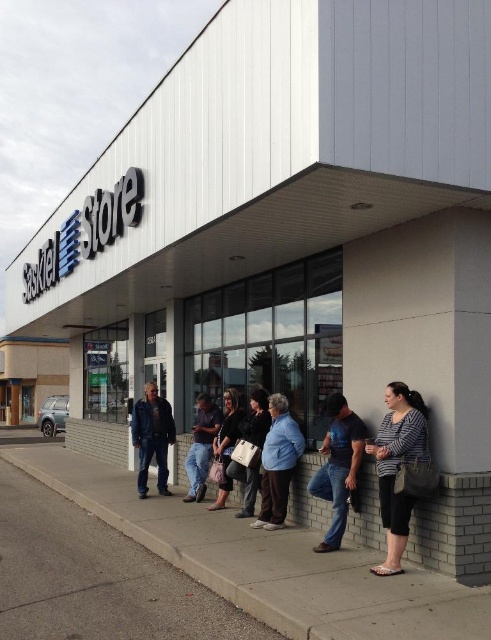
Is blue jeans at center positioned at the back of striped fabric shirt at lower right?

No, blue jeans at center is in front of striped fabric shirt at lower right.

Does point (398, 484) come farther from viewer compared to point (407, 442)?

That is True.

Where is `blue jeans at center`? blue jeans at center is located at coordinates (375, 467).

Can you confirm if gray concrete curb at lower center is taller than jeans at center?

No.

Who is positioned more to the right, gray concrete curb at lower center or jeans at center?

From the viewer's perspective, jeans at center appears more on the right side.

Is point (135, 536) less distant than point (337, 474)?

That is False.

Where is `gray concrete curb at lower center`? Image resolution: width=491 pixels, height=640 pixels. gray concrete curb at lower center is located at coordinates (158, 540).

Is jeans at center shorter than black leather jacket at center?

Yes, jeans at center is shorter than black leather jacket at center.

Is point (341, 484) closer to camera compared to point (256, 486)?

Yes, it is in front of point (256, 486).

Locate an element on the screen. jeans at center is located at coordinates (337, 467).